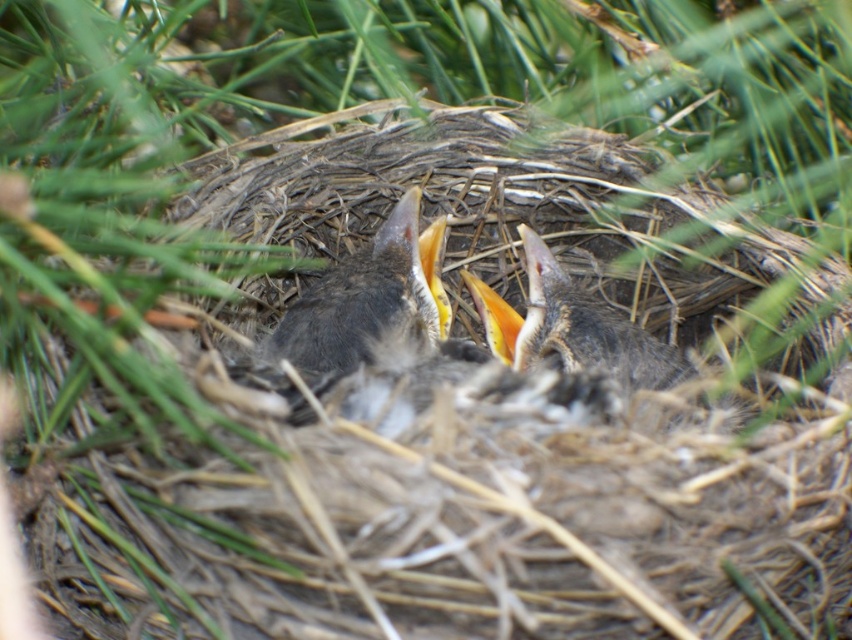
Question: Does dark gray feathers at center appear under soft gray feathers at center?

Choices:
 (A) yes
 (B) no

Answer: (B)

Question: Is dark gray feathers at center wider than soft gray feathers at center?

Choices:
 (A) no
 (B) yes

Answer: (A)

Question: Which of the following is the closest to the observer?

Choices:
 (A) click(x=543, y=276)
 (B) click(x=275, y=330)

Answer: (B)

Question: Which of the following is the closest to the observer?

Choices:
 (A) (543, 243)
 (B) (340, 368)

Answer: (B)

Question: Among these points, which one is farthest from the camera?

Choices:
 (A) (275, 337)
 (B) (580, 332)

Answer: (A)

Question: Where is dark gray feathers at center located in relation to soft gray feathers at center in the image?

Choices:
 (A) left
 (B) right

Answer: (A)